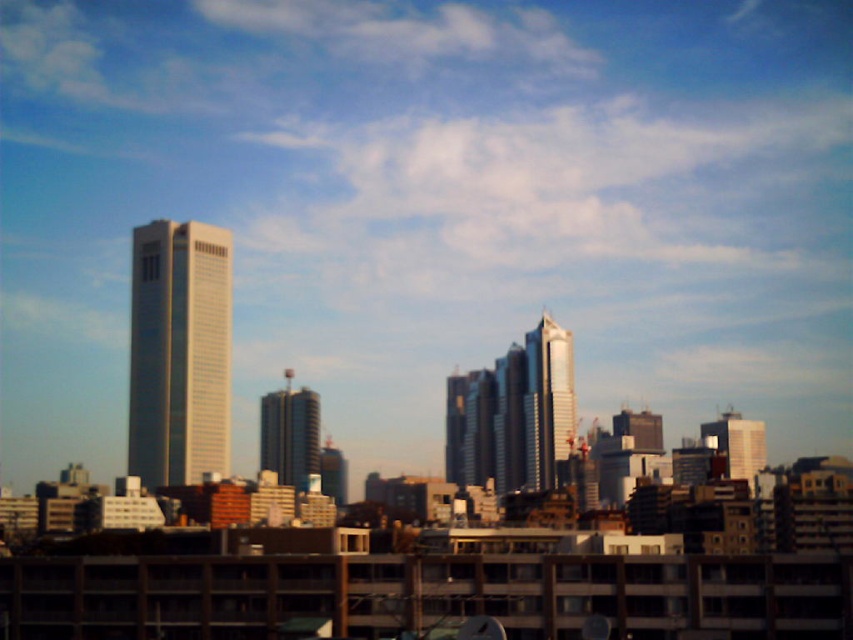
You are standing at the point closest to you in the cityscape image. Which point are you at, point (529, 369) or point (297, 433)?

You are at point (297, 433) because point (529, 369) is behind it, meaning point (297, 433) is closer to you.

You are standing in the cityscape and want to determine which of the two points, point (199, 435) or point (264, 440), is closer to you. Based on the cityscape layout, which point is nearer?

Point (199, 435) is closer to the viewer than point (264, 440).

You are a drone operator planning to fly a drone between the white glossy building at left and the metallic glass building at center. The drone has a maximum flight distance of 40 meters. Can the drone safely fly between these two buildings without exceeding its range?

The white glossy building at left and the metallic glass building at center are 43.10 meters apart from each other. Since the drone has a maximum flight distance of 40 meters, it cannot safely fly between them without exceeding its range.